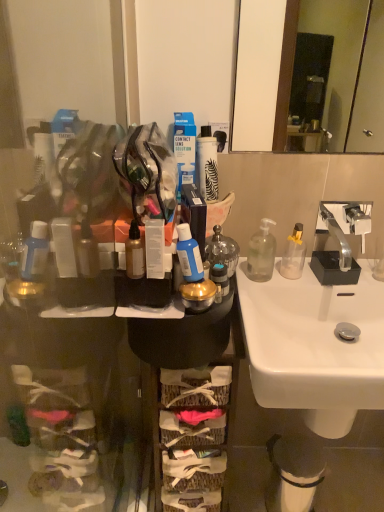
Where is `white matte spray can at center, the second toiletry when ordered from bottom to top`? The width and height of the screenshot is (384, 512). white matte spray can at center, the second toiletry when ordered from bottom to top is located at coordinates (207, 164).

Where is `translucent plastic bottle at center, arranged as the fourth bottle when viewed from the right`? translucent plastic bottle at center, arranged as the fourth bottle when viewed from the right is located at coordinates (134, 253).

What do you see at coordinates (315, 346) in the screenshot? I see `white glossy sink at center` at bounding box center [315, 346].

In the scene shown: What is the approximate width of blue matte bottle at center?

It is 6.01 centimeters.

What do you see at coordinates (222, 250) in the screenshot? I see `translucent glass bottle at center, which ranks as the third bottle in right-to-left order` at bounding box center [222, 250].

The image size is (384, 512). Describe the element at coordinates (261, 253) in the screenshot. I see `transparent plastic soap dispenser at right, which ranks as the 3th bottle in left-to-right order` at that location.

From the picture: What is the approximate height of metallic gold container at center, the 2th toiletry in the top-to-bottom sequence?

2.95 inches.

This screenshot has height=512, width=384. Describe the element at coordinates (194, 426) in the screenshot. I see `woven fabric basket at center` at that location.

Locate an element on the screen. The height and width of the screenshot is (512, 384). white matte spray can at center, which is the 1th toiletry from back to front is located at coordinates (207, 164).

Is transparent plastic soap dispenser at right, acting as the second bottle starting from the right, far away from transparent plastic bottle at sink, arranged as the first bottle when viewed from the right?

They are positioned close to each other.

Can you confirm if transparent plastic soap dispenser at right, which ranks as the 3th bottle in left-to-right order, is smaller than transparent plastic bottle at sink, which is counted as the fourth bottle, starting from the left?

Incorrect, transparent plastic soap dispenser at right, which ranks as the 3th bottle in left-to-right order, is not smaller in size than transparent plastic bottle at sink, which is counted as the fourth bottle, starting from the left.

In terms of height, does transparent plastic soap dispenser at right, which ranks as the 3th bottle in left-to-right order, look taller or shorter compared to transparent plastic bottle at sink, arranged as the first bottle when viewed from the right?

In the image, transparent plastic soap dispenser at right, which ranks as the 3th bottle in left-to-right order, appears to be taller than transparent plastic bottle at sink, arranged as the first bottle when viewed from the right.

Based on the photo, from the image's perspective, does transparent plastic bottle at sink, which is counted as the fourth bottle, starting from the left, appear higher than silver metallic faucet at upper right?

No, from the image's perspective, transparent plastic bottle at sink, which is counted as the fourth bottle, starting from the left, is not on top of silver metallic faucet at upper right.

In terms of width, does transparent plastic bottle at sink, arranged as the first bottle when viewed from the right, look wider or thinner when compared to silver metallic faucet at upper right?

Considering their sizes, transparent plastic bottle at sink, arranged as the first bottle when viewed from the right, looks slimmer than silver metallic faucet at upper right.

Identify the location of tap lying on the right of transparent plastic bottle at sink, arranged as the first bottle when viewed from the right. (345, 225).

From a real-world perspective, is transparent plastic bottle at sink, which is counted as the fourth bottle, starting from the left, on silver metallic faucet at upper right?

No, from a real-world perspective, transparent plastic bottle at sink, which is counted as the fourth bottle, starting from the left, is not over silver metallic faucet at upper right

Is translucent plastic bottle at center, arranged as the fourth bottle when viewed from the right, next to translucent glass bottle at center, which ranks as the third bottle in right-to-left order?

No, translucent plastic bottle at center, arranged as the fourth bottle when viewed from the right, is not making contact with translucent glass bottle at center, which ranks as the third bottle in right-to-left order.

Is translucent plastic bottle at center, arranged as the fourth bottle when viewed from the right, inside the boundaries of translucent glass bottle at center, the 2th bottle viewed from the left, or outside?

The correct answer is: outside.

From the image's perspective, does translucent plastic bottle at center, arranged as the fourth bottle when viewed from the right, appear higher than translucent glass bottle at center, the 2th bottle viewed from the left?

No, from the image's perspective, translucent plastic bottle at center, arranged as the fourth bottle when viewed from the right, is not above translucent glass bottle at center, the 2th bottle viewed from the left.

Are translucent glass bottle at center, the 2th bottle viewed from the left, and white matte spray can at center, the second toiletry in the front-to-back sequence, far apart?

No, translucent glass bottle at center, the 2th bottle viewed from the left, is in close proximity to white matte spray can at center, the second toiletry in the front-to-back sequence.

From the image's perspective, would you say translucent glass bottle at center, the 2th bottle viewed from the left, is positioned over white matte spray can at center, the 1th toiletry from the top?

No, from the image's perspective, translucent glass bottle at center, the 2th bottle viewed from the left, is not above white matte spray can at center, the 1th toiletry from the top.

Considering the relative sizes of translucent glass bottle at center, which ranks as the third bottle in right-to-left order, and white matte spray can at center, the second toiletry in the front-to-back sequence, in the image provided, is translucent glass bottle at center, which ranks as the third bottle in right-to-left order, taller than white matte spray can at center, the second toiletry in the front-to-back sequence,?

Incorrect, the height of translucent glass bottle at center, which ranks as the third bottle in right-to-left order, is not larger of that of white matte spray can at center, the second toiletry in the front-to-back sequence.

Which of these two, translucent glass bottle at center, the 2th bottle viewed from the left, or white matte spray can at center, the second toiletry when ordered from bottom to top, is smaller?

Smaller between the two is white matte spray can at center, the second toiletry when ordered from bottom to top.

Between transparent plastic soap dispenser at right, which ranks as the 3th bottle in left-to-right order, and blue matte bottle at center, which one is positioned in front?

blue matte bottle at center is closer to the camera.

From a real-world perspective, is transparent plastic soap dispenser at right, which ranks as the 3th bottle in left-to-right order, under blue matte bottle at center?

Indeed, from a real-world perspective, transparent plastic soap dispenser at right, which ranks as the 3th bottle in left-to-right order, is positioned beneath blue matte bottle at center.

Which is less distant, (271,246) or (194,264)?

Clearly, point (271,246) is more distant from the camera than point (194,264).

Is blue matte bottle at center at the back of transparent plastic soap dispenser at right, which ranks as the 3th bottle in left-to-right order?

That's not correct — transparent plastic soap dispenser at right, which ranks as the 3th bottle in left-to-right order, is not looking away from blue matte bottle at center.

Is point (291, 315) behind point (259, 257)?

Yes, it is behind point (259, 257).

I want to click on sink that is under the transparent plastic soap dispenser at right, acting as the second bottle starting from the right (from a real-world perspective), so click(x=315, y=346).

Is transparent plastic soap dispenser at right, which ranks as the 3th bottle in left-to-right order, surrounded by white glossy sink at center?

Definitely not — transparent plastic soap dispenser at right, which ranks as the 3th bottle in left-to-right order, is not inside white glossy sink at center.

Does white glossy sink at center lie in front of transparent plastic soap dispenser at right, which ranks as the 3th bottle in left-to-right order?

Yes, white glossy sink at center is closer to the camera.

Does point (306, 502) come in front of point (214, 432)?

That is False.

This screenshot has width=384, height=512. In order to click on trash bin/can on the right of woven fabric basket at center in this screenshot , I will do `click(293, 473)`.

Considering the relative sizes of white plastic trash can at lower right and woven fabric basket at center in the image provided, is white plastic trash can at lower right thinner than woven fabric basket at center?

Yes.

Is white plastic trash can at lower right far away from woven fabric basket at center?

white plastic trash can at lower right is near woven fabric basket at center, not far away.

What are the coordinates of `bottle on the right of transparent plastic soap dispenser at right, acting as the second bottle starting from the right` in the screenshot? It's located at (293, 254).

Locate an element on the screen. This screenshot has height=512, width=384. tap above the transparent plastic bottle at sink, arranged as the first bottle when viewed from the right (from a real-world perspective) is located at coordinates (345, 225).

From the image, which object appears to be nearer to woven fabric basket at center, blue plastic contact lens solution at center or translucent plastic bottle at center, arranged as the fourth bottle when viewed from the right?

Among the two, translucent plastic bottle at center, arranged as the fourth bottle when viewed from the right, is located nearer to woven fabric basket at center.

When comparing their distances from white matte spray can at center, which is the 1th toiletry from back to front, does woven fabric basket at center or silver metallic faucet at upper right seem closer?

Based on the image, silver metallic faucet at upper right appears to be nearer to white matte spray can at center, which is the 1th toiletry from back to front.

Considering their positions, is transparent plastic soap dispenser at right, which ranks as the 3th bottle in left-to-right order, positioned further to woven fabric basket at center than white plastic trash can at lower right?

white plastic trash can at lower right.

From the image, which object appears to be nearer to silver metallic faucet at upper right, transparent plastic bottle at sink, which is counted as the fourth bottle, starting from the left, or transparent plastic soap dispenser at right, acting as the second bottle starting from the right?

The object closer to silver metallic faucet at upper right is transparent plastic bottle at sink, which is counted as the fourth bottle, starting from the left.

Looking at the image, which one is located closer to white plastic trash can at lower right, white matte spray can at center, the second toiletry in the front-to-back sequence, or transparent plastic bottle at sink, which is counted as the fourth bottle, starting from the left?

transparent plastic bottle at sink, which is counted as the fourth bottle, starting from the left, is positioned closer to the anchor white plastic trash can at lower right.

Estimate the real-world distances between objects in this image. Which object is further from blue matte bottle at center, white glossy sink at center or transparent plastic bottle at sink, arranged as the first bottle when viewed from the right?

Based on the image, white glossy sink at center appears to be further to blue matte bottle at center.

Estimate the real-world distances between objects in this image. Which object is further from blue plastic contact lens solution at center, blue matte bottle at center or white glossy sink at center?

white glossy sink at center lies further to blue plastic contact lens solution at center than the other object.

From the image, which object appears to be nearer to white plastic trash can at lower right, metallic gold container at center, the 2th toiletry in the top-to-bottom sequence, or transparent plastic soap dispenser at right, which ranks as the 3th bottle in left-to-right order?

Among the two, transparent plastic soap dispenser at right, which ranks as the 3th bottle in left-to-right order, is located nearer to white plastic trash can at lower right.

At what (x,y) coordinates should I click in order to perform the action: click on toiletry between blue plastic contact lens solution at center and translucent plastic bottle at center, which is the first bottle in left-to-right order, in the vertical direction. Please return your answer as a coordinate pair (x, y). This screenshot has width=384, height=512. Looking at the image, I should click on (207, 164).

Where is `sink between blue matte bottle at center and woven fabric basket at center in the up-down direction`? sink between blue matte bottle at center and woven fabric basket at center in the up-down direction is located at coordinates (315, 346).

I want to click on sink between white matte spray can at center, the 1th toiletry from the top, and woven fabric basket at center in the up-down direction, so click(x=315, y=346).

This screenshot has height=512, width=384. I want to click on toiletry between blue matte bottle at center and woven fabric basket at center in the up-down direction, so pos(220,277).